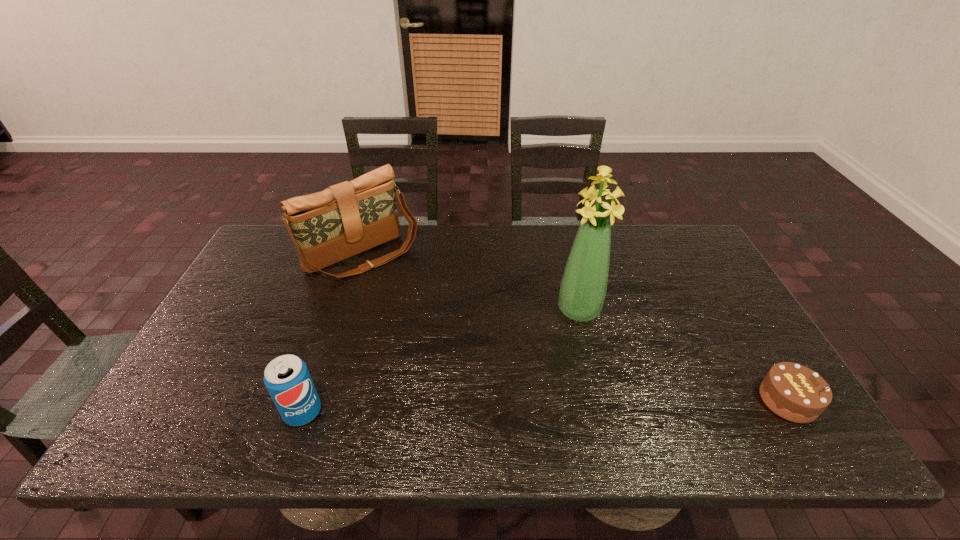
The width and height of the screenshot is (960, 540). In order to click on soda can in this screenshot , I will do `click(287, 379)`.

You are a GUI agent. You are given a task and a screenshot of the screen. Output one action in this format:
    pyautogui.click(x=<x>, y=<y>)
    Task: Click on the rightmost object
    The height and width of the screenshot is (540, 960).
    Given the screenshot: What is the action you would take?
    794,392

This screenshot has width=960, height=540. I want to click on the shortest object, so click(x=794, y=392).

You are a GUI agent. You are given a task and a screenshot of the screen. Output one action in this format:
    pyautogui.click(x=<x>, y=<y>)
    Task: Click on the tallest object
    
    Given the screenshot: What is the action you would take?
    pos(583,288)

Find the location of `bouquet`. bouquet is located at coordinates (583, 288).

This screenshot has width=960, height=540. Identify the location of the second tallest object. (348, 218).

You are a GUI agent. You are given a task and a screenshot of the screen. Output one action in this format:
    pyautogui.click(x=<x>, y=<y>)
    Task: Click on the shoulder bag
    
    Given the screenshot: What is the action you would take?
    pyautogui.click(x=348, y=218)

You are a GUI agent. You are given a task and a screenshot of the screen. Output one action in this format:
    pyautogui.click(x=<x>, y=<y>)
    Task: Click on the free space located 0.380m on the right of the soda can
    
    Given the screenshot: What is the action you would take?
    pyautogui.click(x=489, y=412)

Find the location of `vacant position located 0.190m on the left of the chocolate cake`. vacant position located 0.190m on the left of the chocolate cake is located at coordinates (680, 400).

I want to click on vacant position located on the front-facing side of the bouquet, so click(x=577, y=343).